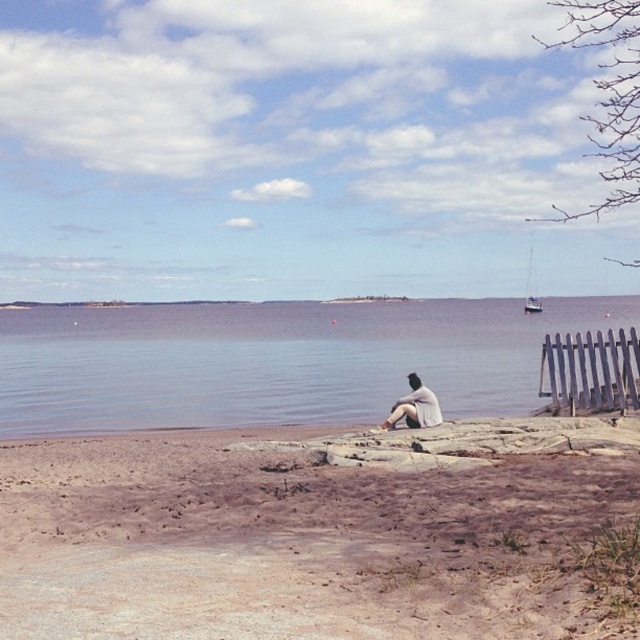
The width and height of the screenshot is (640, 640). Describe the element at coordinates (275, 360) in the screenshot. I see `blue water at center` at that location.

You are a GUI agent. You are given a task and a screenshot of the screen. Output one action in this format:
    pyautogui.click(x=<x>, y=<y>)
    Task: Click on the blue water at center
    This screenshot has height=640, width=640.
    Given the screenshot: What is the action you would take?
    pos(275,360)

The height and width of the screenshot is (640, 640). Identify the location of blue water at center. (275, 360).

Does white cotton shirt at lower center appear on the left side of white glossy sailboat at right?

Indeed, white cotton shirt at lower center is positioned on the left side of white glossy sailboat at right.

Does white cotton shirt at lower center have a greater width compared to white glossy sailboat at right?

No.

This screenshot has width=640, height=640. Identify the location of white cotton shirt at lower center. (413, 406).

Locate an element on the screen. The width and height of the screenshot is (640, 640). white cotton shirt at lower center is located at coordinates (413, 406).

Between gray wooden fence at lower right and white cotton shirt at lower center, which one has more height?

gray wooden fence at lower right is taller.

Who is more forward, (628, 380) or (420, 424)?

Point (420, 424) is more forward.

Identify the location of gray wooden fence at lower right. (589, 371).